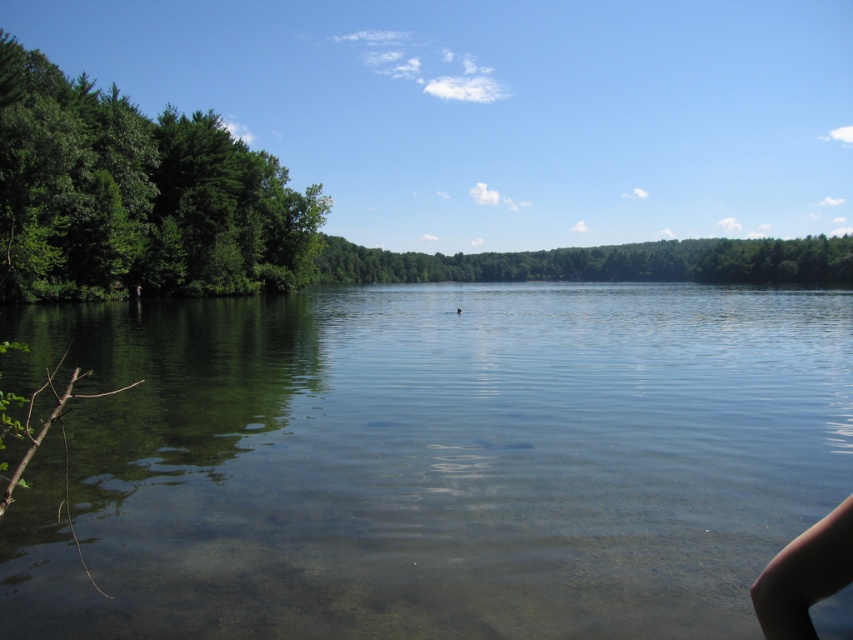
Question: Which object is closer to the camera taking this photo?

Choices:
 (A) green leafy trees at left
 (B) skinny tan leg at lower right
 (C) clear water at center

Answer: (B)

Question: Which object appears closest to the camera in this image?

Choices:
 (A) green leafy trees at center
 (B) clear water at center
 (C) green leafy trees at left

Answer: (B)

Question: Is clear water at center above green leafy trees at center?

Choices:
 (A) no
 (B) yes

Answer: (A)

Question: Which point is closer to the camera?

Choices:
 (A) (682, 246)
 (B) (561, 470)
 (C) (165, 109)

Answer: (B)

Question: Is clear water at center above green leafy trees at left?

Choices:
 (A) no
 (B) yes

Answer: (A)

Question: In this image, where is clear water at center located relative to green leafy trees at center?

Choices:
 (A) right
 (B) left

Answer: (B)